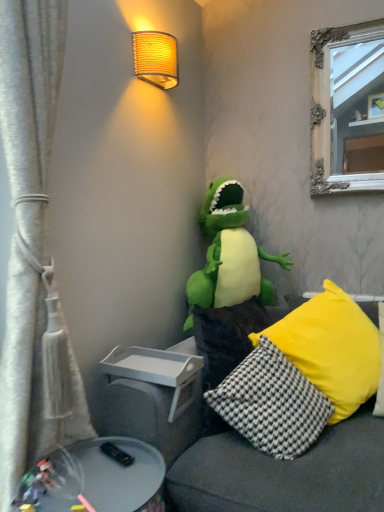
This screenshot has width=384, height=512. What do you see at coordinates (229, 254) in the screenshot? I see `green plush toy at center` at bounding box center [229, 254].

Where is `green plush toy at center`? This screenshot has height=512, width=384. green plush toy at center is located at coordinates (229, 254).

What do you see at coordinates (332, 348) in the screenshot?
I see `yellow fabric pillow at right, the first pillow in the right-to-left sequence` at bounding box center [332, 348].

Where is `black-and-white checkered pillow at lower right, the 2th pillow when ordered from left to right`? This screenshot has width=384, height=512. black-and-white checkered pillow at lower right, the 2th pillow when ordered from left to right is located at coordinates (271, 403).

Locate an element on the screen. woven fabric lampshade at upper center is located at coordinates (156, 58).

Between metallic gray tray at lower left and yellow textured pillow at center, positioned as the third pillow in right-to-left order, which one has smaller size?

metallic gray tray at lower left is smaller.

Is metallic gray tray at lower left far away from yellow textured pillow at center, the 1th pillow viewed from the left?

metallic gray tray at lower left is actually quite close to yellow textured pillow at center, the 1th pillow viewed from the left.

Considering the sizes of metallic gray tray at lower left and yellow textured pillow at center, the 1th pillow viewed from the left, in the image, is metallic gray tray at lower left wider or thinner than yellow textured pillow at center, the 1th pillow viewed from the left,?

metallic gray tray at lower left is wider than yellow textured pillow at center, the 1th pillow viewed from the left.

Does soft gray couch at center have a smaller size compared to black-and-white checkered pillow at lower right, the 2th pillow when ordered from left to right?

Incorrect, soft gray couch at center is not smaller in size than black-and-white checkered pillow at lower right, the 2th pillow when ordered from left to right.

Which object is further away from the camera taking this photo, soft gray couch at center or black-and-white checkered pillow at lower right, the 2th pillow when ordered from left to right?

black-and-white checkered pillow at lower right, the 2th pillow when ordered from left to right, is further away from the camera.

From the image's perspective, between soft gray couch at center and black-and-white checkered pillow at lower right, the 2th pillow when ordered from left to right, which one is located above?

black-and-white checkered pillow at lower right, the 2th pillow when ordered from left to right, from the image's perspective.

From the picture: From a real-world perspective, which is physically below, soft gray couch at center or black-and-white checkered pillow at lower right, which is the 2th pillow in right-to-left order?

In real-world perspective, soft gray couch at center is lower.

Could you tell me if black-and-white checkered pillow at lower right, the 2th pillow when ordered from left to right, is facing yellow textured pillow at center, positioned as the third pillow in right-to-left order?

No.

Between black-and-white checkered pillow at lower right, the 2th pillow when ordered from left to right, and yellow textured pillow at center, the 1th pillow viewed from the left, which one has less height?

Answer: black-and-white checkered pillow at lower right, the 2th pillow when ordered from left to right, is shorter.

Is black-and-white checkered pillow at lower right, which is the 2th pillow in right-to-left order, bigger than yellow textured pillow at center, the 1th pillow viewed from the left?

Actually, black-and-white checkered pillow at lower right, which is the 2th pillow in right-to-left order, might be smaller than yellow textured pillow at center, the 1th pillow viewed from the left.

Which point is more distant from viewer, (x=297, y=390) or (x=249, y=329)?

The point (x=249, y=329) is more distant.

Who is smaller, black-and-white checkered pillow at lower right, the 2th pillow when ordered from left to right, or yellow fabric pillow at right, the third pillow when ordered from left to right?

black-and-white checkered pillow at lower right, the 2th pillow when ordered from left to right.

Measure the distance between black-and-white checkered pillow at lower right, which is the 2th pillow in right-to-left order, and yellow fabric pillow at right, the third pillow when ordered from left to right.

A distance of 6.88 inches exists between black-and-white checkered pillow at lower right, which is the 2th pillow in right-to-left order, and yellow fabric pillow at right, the third pillow when ordered from left to right.

The width and height of the screenshot is (384, 512). What are the coordinates of `the 1st pillow to the left when counting from the yellow fabric pillow at right, the first pillow in the right-to-left sequence` in the screenshot? It's located at pos(271,403).

From the image's perspective, is black-and-white checkered pillow at lower right, which is the 2th pillow in right-to-left order, above or below yellow fabric pillow at right, the first pillow in the right-to-left sequence?

black-and-white checkered pillow at lower right, which is the 2th pillow in right-to-left order, is situated lower than yellow fabric pillow at right, the first pillow in the right-to-left sequence, in the image.

From a real-world perspective, is white textured curtain at left positioned above or below woven fabric lampshade at upper center?

Clearly, from a real-world perspective, white textured curtain at left is below woven fabric lampshade at upper center.

How many degrees apart are the facing directions of white textured curtain at left and woven fabric lampshade at upper center?

white textured curtain at left and woven fabric lampshade at upper center are facing 4.49 degrees away from each other.

Is white textured curtain at left outside of woven fabric lampshade at upper center?

Yes.

How much distance is there between soft gray couch at center and woven fabric lampshade at upper center?

soft gray couch at center is 4.43 feet away from woven fabric lampshade at upper center.

From the image's perspective, between soft gray couch at center and woven fabric lampshade at upper center, who is located below?

soft gray couch at center.

Consider the image. Between soft gray couch at center and woven fabric lampshade at upper center, which one has smaller width?

With smaller width is woven fabric lampshade at upper center.

In terms of height, does soft gray couch at center look taller or shorter compared to woven fabric lampshade at upper center?

Clearly, soft gray couch at center is taller compared to woven fabric lampshade at upper center.

From the picture: Considering the sizes of objects metallic gray tray at lower left and white textured curtain at left in the image provided, who is smaller, metallic gray tray at lower left or white textured curtain at left?

Smaller between the two is metallic gray tray at lower left.

Could you tell me if metallic gray tray at lower left is turned towards white textured curtain at left?

No, metallic gray tray at lower left is not oriented towards white textured curtain at left.

Between metallic gray tray at lower left and white textured curtain at left, which one is positioned in front?

metallic gray tray at lower left is in front.

From a real-world perspective, who is located higher, metallic gray tray at lower left or white textured curtain at left?

white textured curtain at left is physically above.

From the image's perspective, which pillow is the 2nd one above the metallic gray tray at lower left? Please provide its 2D coordinates.

[(228, 336)]

Find the location of a particular element. This screenshot has width=384, height=512. studio couch in front of the black-and-white checkered pillow at lower right, the 2th pillow when ordered from left to right is located at coordinates (251, 459).

Considering their positions, is green plush toy at center positioned closer to black-and-white checkered pillow at lower right, which is the 2th pillow in right-to-left order, than yellow textured pillow at center, positioned as the third pillow in right-to-left order?

yellow textured pillow at center, positioned as the third pillow in right-to-left order.

Based on their spatial positions, is soft gray couch at center or woven fabric lampshade at upper center closer to black-and-white checkered pillow at lower right, the 2th pillow when ordered from left to right?

The object closer to black-and-white checkered pillow at lower right, the 2th pillow when ordered from left to right, is soft gray couch at center.

Which object lies nearer to the anchor point green plush toy at center, white textured curtain at left or yellow fabric pillow at right, the third pillow when ordered from left to right?

Among the two, yellow fabric pillow at right, the third pillow when ordered from left to right, is located nearer to green plush toy at center.

From the picture: From the image, which object appears to be farther from white textured curtain at left, metallic gray tray at lower left or yellow textured pillow at center, positioned as the third pillow in right-to-left order?

Among the two, yellow textured pillow at center, positioned as the third pillow in right-to-left order, is located further to white textured curtain at left.

Which object lies further to the anchor point soft gray couch at center, yellow textured pillow at center, positioned as the third pillow in right-to-left order, or woven fabric lampshade at upper center?

woven fabric lampshade at upper center lies further to soft gray couch at center than the other object.

Which object lies further to the anchor point yellow textured pillow at center, the 1th pillow viewed from the left, soft gray couch at center or metallic gray tray at lower left?

The object further to yellow textured pillow at center, the 1th pillow viewed from the left, is metallic gray tray at lower left.

Looking at the image, which one is located further to soft gray couch at center, yellow fabric pillow at right, the third pillow when ordered from left to right, or white textured curtain at left?

Based on the image, white textured curtain at left appears to be further to soft gray couch at center.

Looking at this image, from the image, which object appears to be farther from yellow textured pillow at center, the 1th pillow viewed from the left, green plush toy at center or yellow fabric pillow at right, the third pillow when ordered from left to right?

green plush toy at center is positioned further to the anchor yellow textured pillow at center, the 1th pillow viewed from the left.

Where is `toy between woven fabric lampshade at upper center and soft gray couch at center in the up-down direction`? toy between woven fabric lampshade at upper center and soft gray couch at center in the up-down direction is located at coordinates (229, 254).

Identify the location of pillow between woven fabric lampshade at upper center and yellow textured pillow at center, the 1th pillow viewed from the left, in the vertical direction. (332, 348).

Locate an element on the screen. This screenshot has width=384, height=512. curtain between woven fabric lampshade at upper center and soft gray couch at center vertically is located at coordinates (33, 249).

The width and height of the screenshot is (384, 512). I want to click on toy between woven fabric lampshade at upper center and white textured curtain at left in the vertical direction, so click(229, 254).